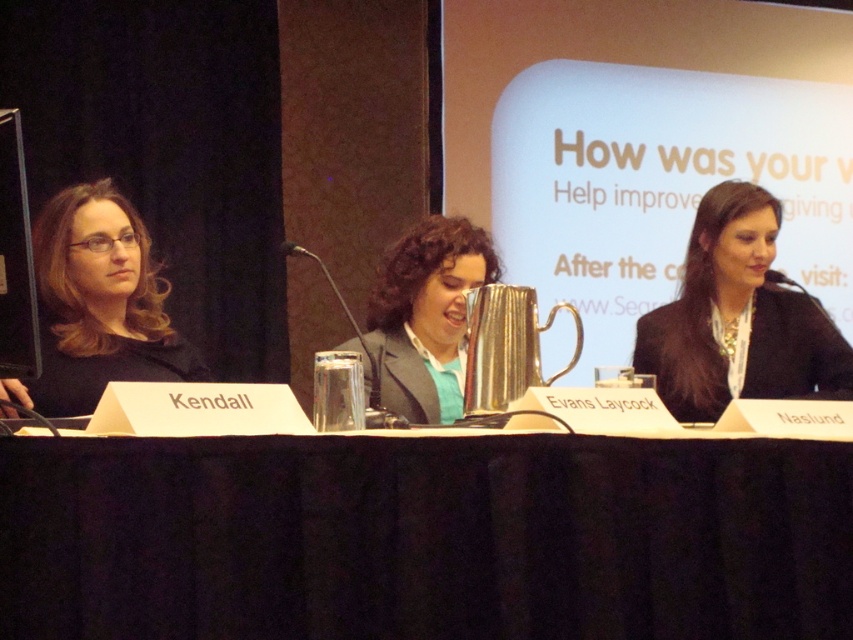
Question: Which of the following is the closest to the observer?

Choices:
 (A) black fabric table at center
 (B) black silk blazer at right
 (C) matte black jacket at left
 (D) metallic silver pitcher at center

Answer: (A)

Question: Which point is closer to the camera taking this photo?

Choices:
 (A) tap(393, 518)
 (B) tap(813, 339)
 (C) tap(22, 404)

Answer: (A)

Question: Does black silk blazer at right have a smaller size compared to matte black jacket at left?

Choices:
 (A) yes
 (B) no

Answer: (A)

Question: Does matte black jacket at left appear on the right side of metallic silver pitcher at center?

Choices:
 (A) no
 (B) yes

Answer: (A)

Question: Which of the following is the closest to the observer?

Choices:
 (A) (750, 369)
 (B) (401, 518)
 (C) (107, 324)

Answer: (B)

Question: Can you confirm if black silk blazer at right is positioned to the right of metallic silver pitcher at center?

Choices:
 (A) no
 (B) yes

Answer: (B)